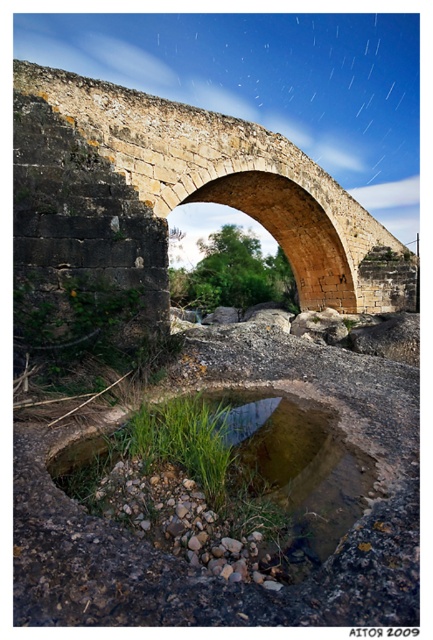
From the picture: Is yellowish stone bridge at center to the left of clear water at center from the viewer's perspective?

In fact, yellowish stone bridge at center is to the right of clear water at center.

Does point (374, 221) come in front of point (239, 417)?

No, (374, 221) is further to viewer.

Locate an element on the screen. Image resolution: width=433 pixels, height=640 pixels. yellowish stone bridge at center is located at coordinates (202, 193).